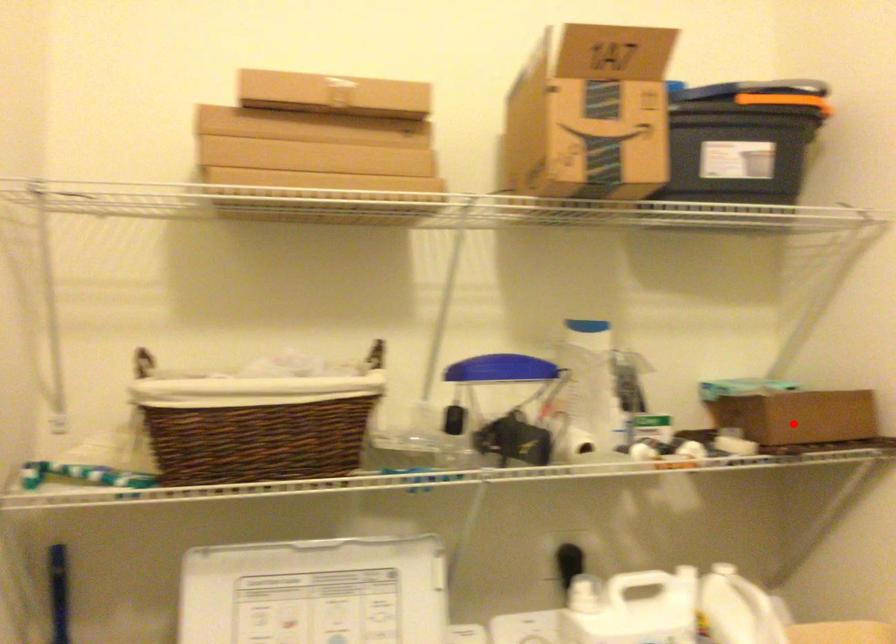
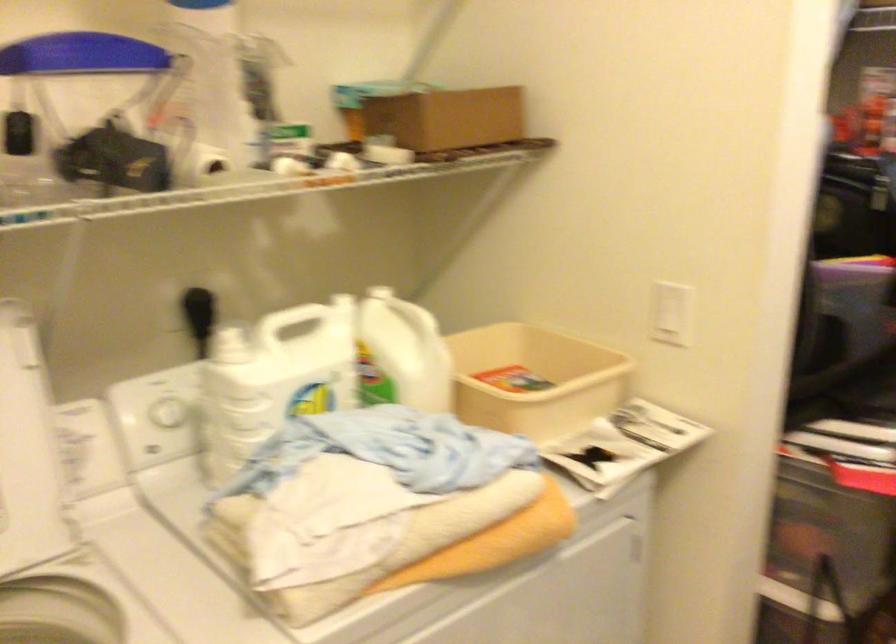
Question: I am providing you with two images of the same scene from different viewpoints. A red point is shown in image1. For the corresponding object point in image2, is it positioned nearer or farther from the camera?

Choices:
 (A) Nearer
 (B) Farther

Answer: (A)